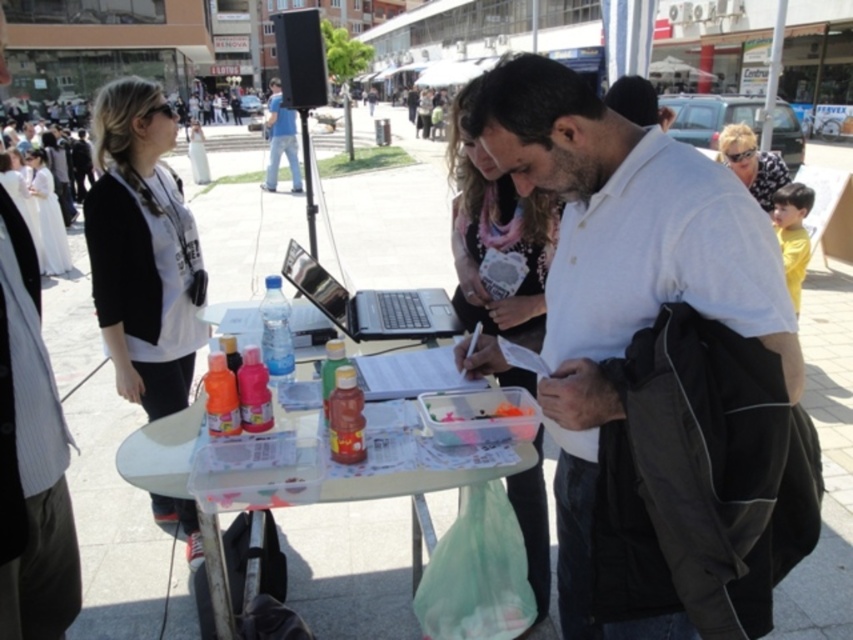
Question: Which point is farther to the camera?

Choices:
 (A) white satin dress at upper left
 (B) matte black jacket at left
 (C) black plastic laptop at center

Answer: (A)

Question: Among these points, which one is nearest to the camera?

Choices:
 (A) (44, 164)
 (B) (778, 182)
 (C) (479, 234)
 (D) (177, 449)

Answer: (D)

Question: Is the position of black plastic laptop at center less distant than that of patterned fabric shirt at upper right?

Choices:
 (A) no
 (B) yes

Answer: (B)

Question: Which is nearer to the black plastic laptop at center?

Choices:
 (A) blue jeans at center
 (B) clear plastic tray at center

Answer: (B)

Question: Can you confirm if matte black jacket at left is bigger than clear plastic tray at center?

Choices:
 (A) no
 (B) yes

Answer: (B)

Question: Can you confirm if matte black jacket at left is positioned to the left of white satin dress at upper left?

Choices:
 (A) no
 (B) yes

Answer: (A)